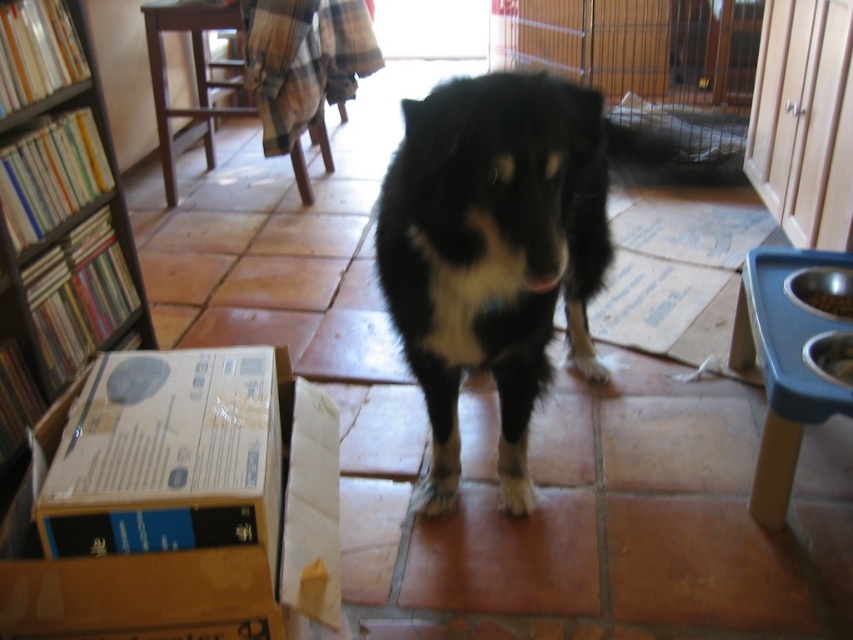
Which is behind, point (579, 140) or point (7, 368)?

The point (7, 368) is more distant.

Where is `black fur dog at center`? black fur dog at center is located at coordinates (497, 250).

Can you confirm if cardboard box at lower left is thinner than wooden bookshelf at left?

No.

Does cardboard box at lower left have a greater width compared to wooden bookshelf at left?

Yes, cardboard box at lower left is wider than wooden bookshelf at left.

Find the location of a particular element. Image resolution: width=853 pixels, height=640 pixels. cardboard box at lower left is located at coordinates (180, 502).

Does cardboard box at lower left appear over wooden cage at center?

Incorrect, cardboard box at lower left is not positioned above wooden cage at center.

Consider the image. Can you confirm if cardboard box at lower left is positioned to the right of wooden cage at center?

Incorrect, cardboard box at lower left is not on the right side of wooden cage at center.

Which is behind, point (316, 529) or point (508, 60)?

The point (508, 60) is behind.

The height and width of the screenshot is (640, 853). I want to click on cardboard box at lower left, so click(180, 502).